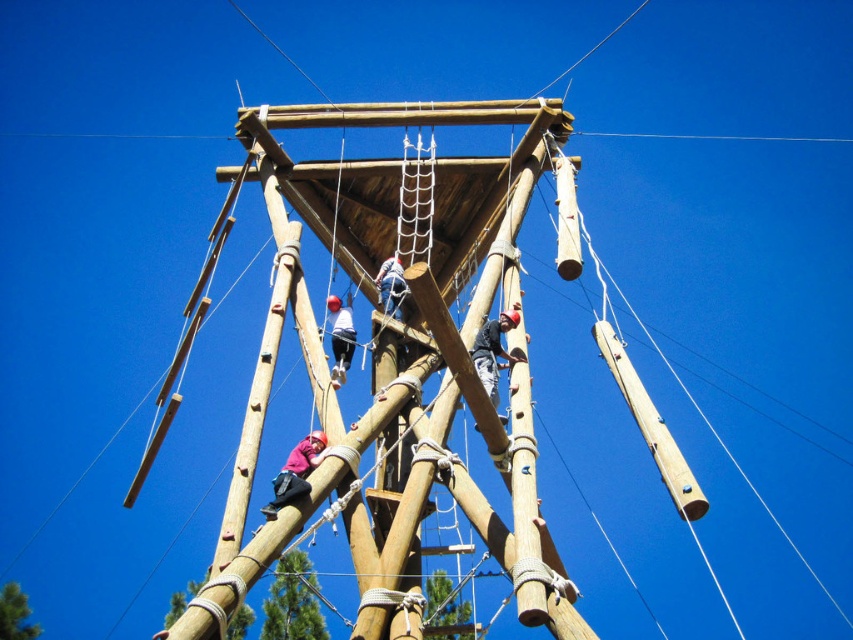
Question: Is pink fabric at center further to camera compared to blue fabric climbing harness at center?

Choices:
 (A) no
 (B) yes

Answer: (A)

Question: Which point is farther to the camera?

Choices:
 (A) pink fabric at center
 (B) white fabric helmet at center
 (C) dark gray fabric climbing harness at center
 (D) blue fabric climbing harness at center

Answer: (D)

Question: Which object is closer to the camera taking this photo?

Choices:
 (A) blue fabric climbing harness at center
 (B) white fabric helmet at center

Answer: (B)

Question: Is dark gray fabric climbing harness at center positioned before pink fabric at center?

Choices:
 (A) yes
 (B) no

Answer: (B)

Question: Which point is farther from the camera taking this photo?

Choices:
 (A) (326, 301)
 (B) (395, 288)

Answer: (A)

Question: From the image, what is the correct spatial relationship of pink fabric at center in relation to white fabric helmet at center?

Choices:
 (A) above
 (B) below

Answer: (B)